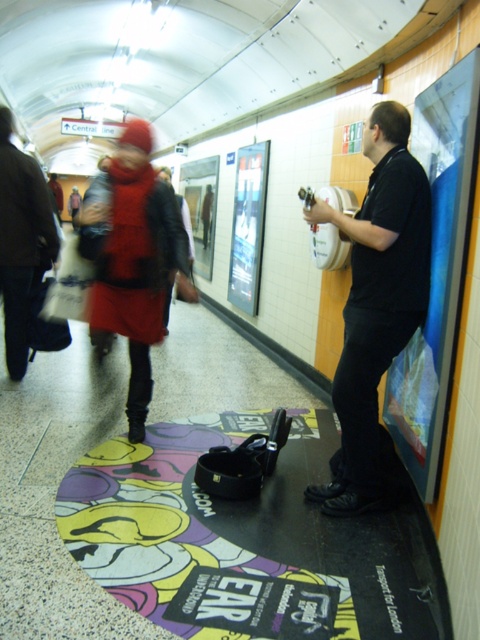
Is black matte shirt at center to the left of matte plastic poster at right from the viewer's perspective?

Indeed, black matte shirt at center is positioned on the left side of matte plastic poster at right.

Who is higher up, black matte shirt at center or matte plastic poster at right?

Positioned higher is matte plastic poster at right.

Who is more distant from viewer, [346,412] or [469,184]?

Positioned behind is point [346,412].

You are a GUI agent. You are given a task and a screenshot of the screen. Output one action in this format:
    pyautogui.click(x=<x>, y=<y>)
    Task: Click on the black matte shirt at center
    The image size is (480, 640).
    Given the screenshot: What is the action you would take?
    pyautogui.click(x=375, y=305)

Can you confirm if black matte shirt at center is wider than velvet red coat at left?

No, black matte shirt at center is not wider than velvet red coat at left.

Describe the element at coordinates (375, 305) in the screenshot. I see `black matte shirt at center` at that location.

Is point (342, 396) behind point (118, 141)?

No, (342, 396) is in front of (118, 141).

Image resolution: width=480 pixels, height=640 pixels. In order to click on black matte shirt at center in this screenshot , I will do `click(375, 305)`.

Is multicolored fabric mat at center positioned before metallic silver poster at center?

Yes, multicolored fabric mat at center is in front of metallic silver poster at center.

Does point (190, 480) come in front of point (251, 304)?

Yes, it is.

Which is in front, point (428, 572) or point (256, 148)?

Point (428, 572)

Find the location of a particular element. The image size is (480, 640). multicolored fabric mat at center is located at coordinates (247, 541).